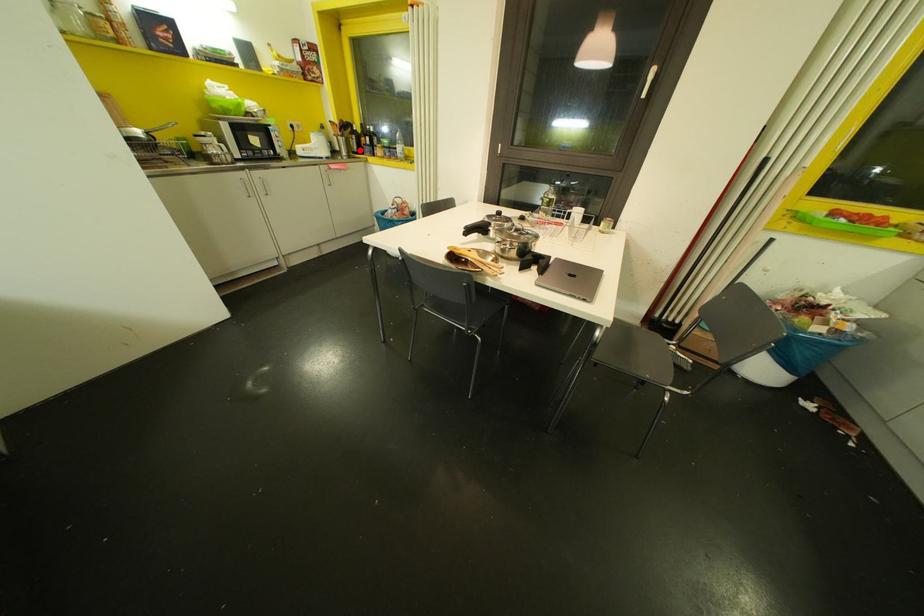
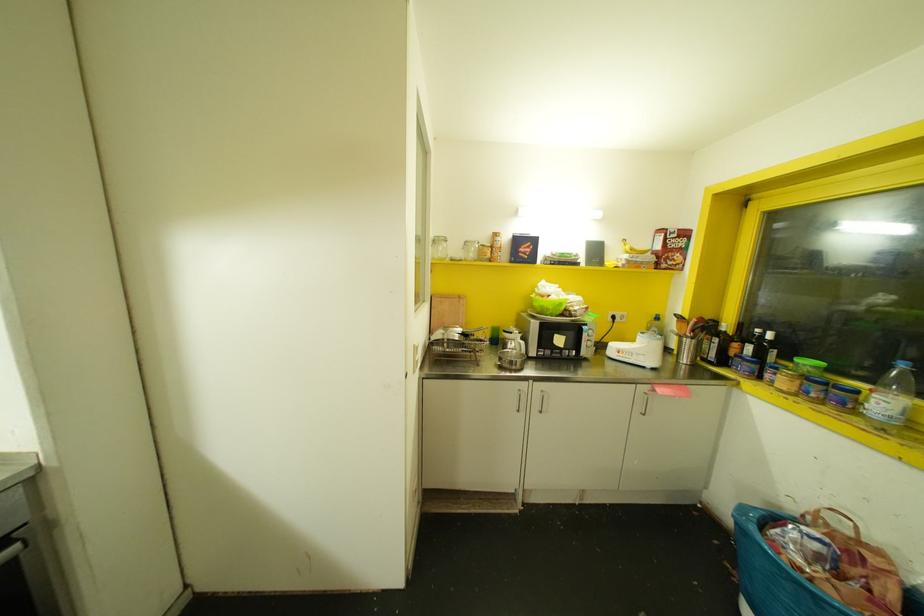
In the second image, find the point that corresponds to the highlighted location in the first image.

(723, 361)